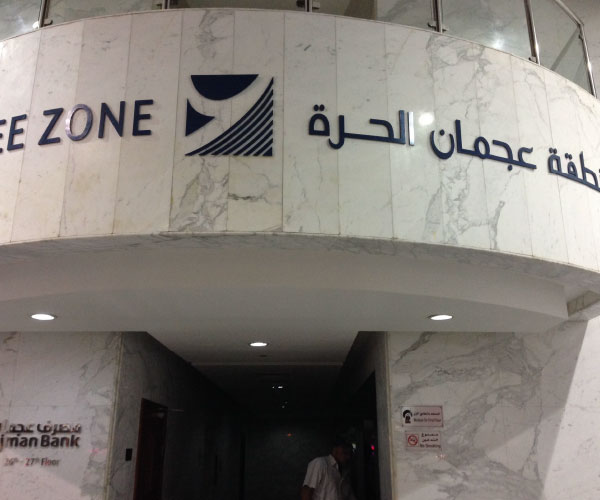
Identify the location of lights on roof. (38, 317), (252, 343), (438, 314).